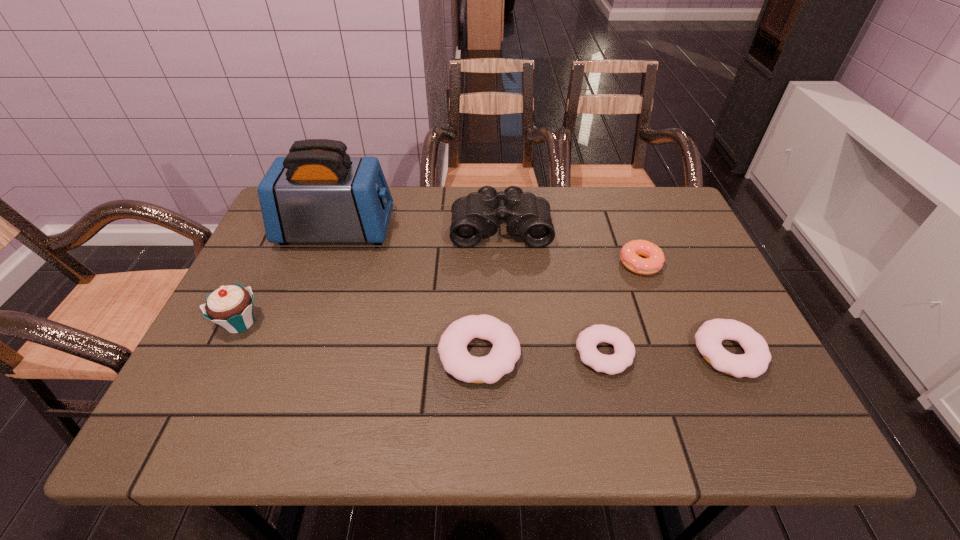
I want to click on object at the near right corner, so click(754, 362).

I want to click on vacant area at the far edge, so click(444, 230).

In the image, there is a desktop. At what (x,y) coordinates should I click in order to perform the action: click on free space at the near edge. Please return your answer as a coordinate pair (x, y). The width and height of the screenshot is (960, 540). Looking at the image, I should click on (551, 367).

Where is `blank space at the left edge`? This screenshot has height=540, width=960. blank space at the left edge is located at coordinates (301, 285).

I want to click on free location at the right edge of the desktop, so click(x=674, y=288).

This screenshot has height=540, width=960. In the image, there is a desktop. In order to click on vacant space at the far right corner in this screenshot , I will do `click(627, 188)`.

Where is `free area in between the farthest doughnut and the second shortest object`? The width and height of the screenshot is (960, 540). free area in between the farthest doughnut and the second shortest object is located at coordinates (684, 308).

In order to click on free space between the tallest object and the shortest doughnut in this screenshot , I will do `click(470, 292)`.

Where is `empty space between the binoculars and the farthest doughnut`? This screenshot has width=960, height=540. empty space between the binoculars and the farthest doughnut is located at coordinates (570, 245).

What are the coordinates of `blank region between the binoculars and the farthest doughnut` in the screenshot? It's located at (570, 245).